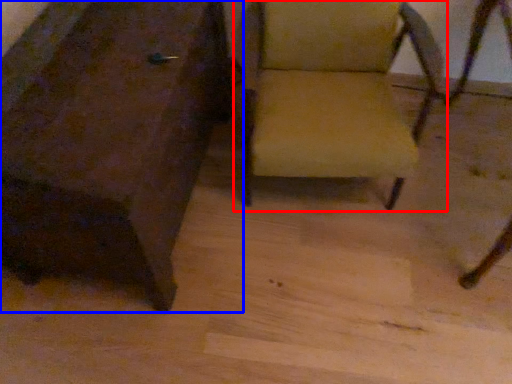
Question: Among these objects, which one is farthest to the camera, chair (highlighted by a red box) or chair (highlighted by a blue box)?

Choices:
 (A) chair
 (B) chair

Answer: (A)